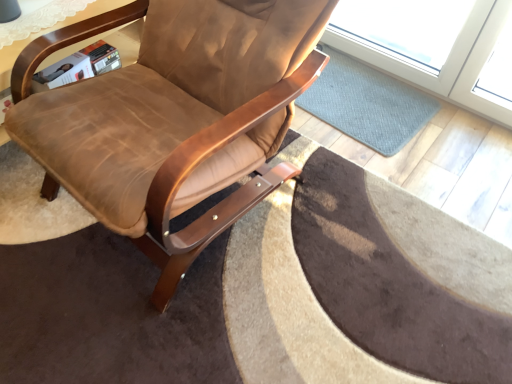
Where is `blue textured mat at center`? blue textured mat at center is located at coordinates (367, 103).

The image size is (512, 384). Identify the location of brown leather chair at center. (173, 118).

Locate an element on the screen. The image size is (512, 384). blue textured mat at center is located at coordinates (367, 103).

Which of these two, brown leather chair at center or wooden table at upper left, is thinner?

With smaller width is wooden table at upper left.

How distant is brown leather chair at center from wooden table at upper left?

The distance of brown leather chair at center from wooden table at upper left is 13.21 inches.

Is brown leather chair at center positioned before wooden table at upper left?

Yes.

From the image's perspective, between brown leather chair at center and wooden table at upper left, which one is located above?

wooden table at upper left is shown above in the image.

From the picture: Does blue textured mat at center appear on the right side of brown leather chair at center?

Yes, blue textured mat at center is to the right of brown leather chair at center.

Based on the photo, considering the relative sizes of blue textured mat at center and brown leather chair at center in the image provided, is blue textured mat at center wider than brown leather chair at center?

No.

Looking at this image, what's the angular difference between blue textured mat at center and brown leather chair at center's facing directions?

The facing directions of blue textured mat at center and brown leather chair at center are 0.622 degrees apart.

From the picture: Is blue textured mat at center facing away from brown leather chair at center?

No, blue textured mat at center's orientation is not away from brown leather chair at center.

Considering the relative sizes of wooden table at upper left and blue textured mat at center in the image provided, is wooden table at upper left bigger than blue textured mat at center?

Correct, wooden table at upper left is larger in size than blue textured mat at center.

Which object is closer to the camera, wooden table at upper left or blue textured mat at center?

wooden table at upper left is more forward.

From the image's perspective, relative to blue textured mat at center, is wooden table at upper left above or below?

From the image's perspective, wooden table at upper left appears below blue textured mat at center.

Is wooden table at upper left positioned with its back to blue textured mat at center?

No, wooden table at upper left's orientation is not away from blue textured mat at center.

Which of these two, brown leather chair at center or blue textured mat at center, is thinner?

blue textured mat at center.

Is brown leather chair at center positioned in front of blue textured mat at center?

That is True.

Is brown leather chair at center directly adjacent to blue textured mat at center?

No, brown leather chair at center is not beside blue textured mat at center.

Is brown leather chair at center outside of blue textured mat at center?

Absolutely, brown leather chair at center is external to blue textured mat at center.

In the image, is blue textured mat at center on the left side or the right side of wooden table at upper left?

Clearly, blue textured mat at center is on the right of wooden table at upper left in the image.

Which of these two, blue textured mat at center or wooden table at upper left, stands taller?

With more height is wooden table at upper left.

Between blue textured mat at center and wooden table at upper left, which one is positioned in front?

wooden table at upper left is closer to the camera.

Can you confirm if blue textured mat at center is smaller than wooden table at upper left?

Yes.

Is wooden table at upper left taller than brown leather chair at center?

Incorrect, the height of wooden table at upper left is not larger of that of brown leather chair at center.

How many degrees apart are the facing directions of wooden table at upper left and brown leather chair at center?

wooden table at upper left and brown leather chair at center are facing 4.09 degrees away from each other.

Considering the positions of point (22, 66) and point (326, 63), is point (22, 66) closer or farther from the camera than point (326, 63)?

Point (22, 66).

Considering the positions of objects wooden table at upper left and brown leather chair at center in the image provided, who is behind, wooden table at upper left or brown leather chair at center?

wooden table at upper left is behind.

Identify the location of chair on the right of wooden table at upper left. This screenshot has width=512, height=384. (173, 118).

Locate an element on the screen. The height and width of the screenshot is (384, 512). chair that is on the left side of blue textured mat at center is located at coordinates (173, 118).

From the image, which object appears to be farther from wooden table at upper left, blue textured mat at center or brown leather chair at center?

blue textured mat at center is further to wooden table at upper left.

Looking at the image, which one is located closer to brown leather chair at center, blue textured mat at center or wooden table at upper left?

wooden table at upper left is closer to brown leather chair at center.

Estimate the real-world distances between objects in this image. Which object is closer to blue textured mat at center, brown leather chair at center or wooden table at upper left?

brown leather chair at center is positioned closer to the anchor blue textured mat at center.

Considering their positions, is wooden table at upper left positioned further to blue textured mat at center than brown leather chair at center?

wooden table at upper left is further to blue textured mat at center.

Estimate the real-world distances between objects in this image. Which object is closer to brown leather chair at center, wooden table at upper left or blue textured mat at center?

The object closer to brown leather chair at center is wooden table at upper left.

Looking at the image, which one is located further to wooden table at upper left, brown leather chair at center or blue textured mat at center?

blue textured mat at center.

This screenshot has width=512, height=384. Find the location of `chair located between wooden table at upper left and blue textured mat at center in the left-right direction`. chair located between wooden table at upper left and blue textured mat at center in the left-right direction is located at coordinates (173, 118).